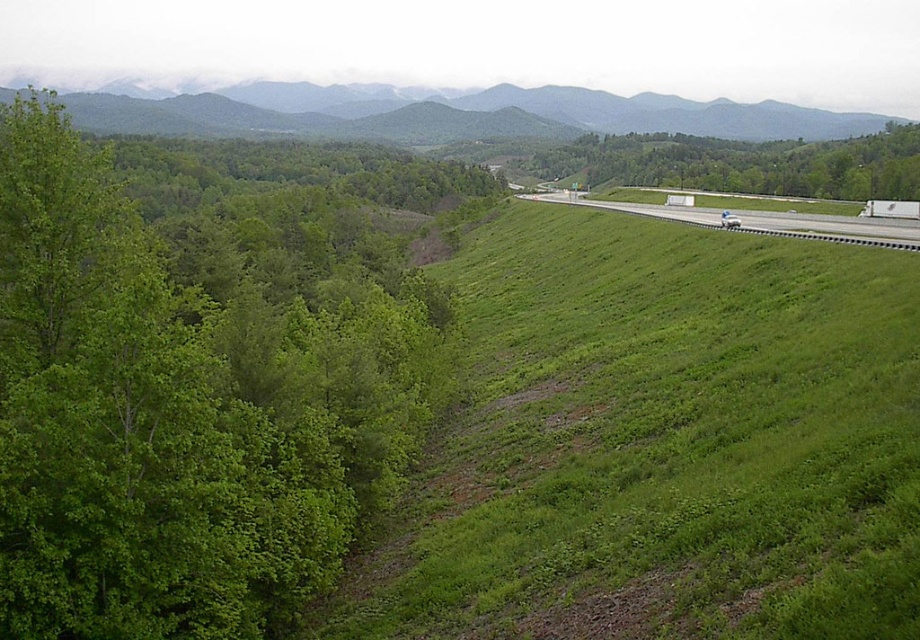
Question: Does green leafy tree at left appear under green grassy hillside at upper center?

Choices:
 (A) yes
 (B) no

Answer: (A)

Question: Which object is farther from the camera taking this photo?

Choices:
 (A) white asphalt highway at right
 (B) green leafy tree at left
 (C) green grassy hillside at upper center
 (D) green leafy tree at center

Answer: (C)

Question: Which point is farther from the camera taking this photo?

Choices:
 (A) (875, 225)
 (B) (289, 104)
 (C) (745, 186)
 (D) (332, 284)

Answer: (B)

Question: Which is nearer to the white asphalt highway at right?

Choices:
 (A) green grassy hillside at upper center
 (B) green leafy tree at left

Answer: (B)

Question: From the image, what is the correct spatial relationship of green leafy tree at center in relation to white asphalt highway at right?

Choices:
 (A) left
 (B) right

Answer: (B)

Question: From the image, what is the correct spatial relationship of green leafy tree at left in relation to white asphalt highway at right?

Choices:
 (A) left
 (B) right

Answer: (A)